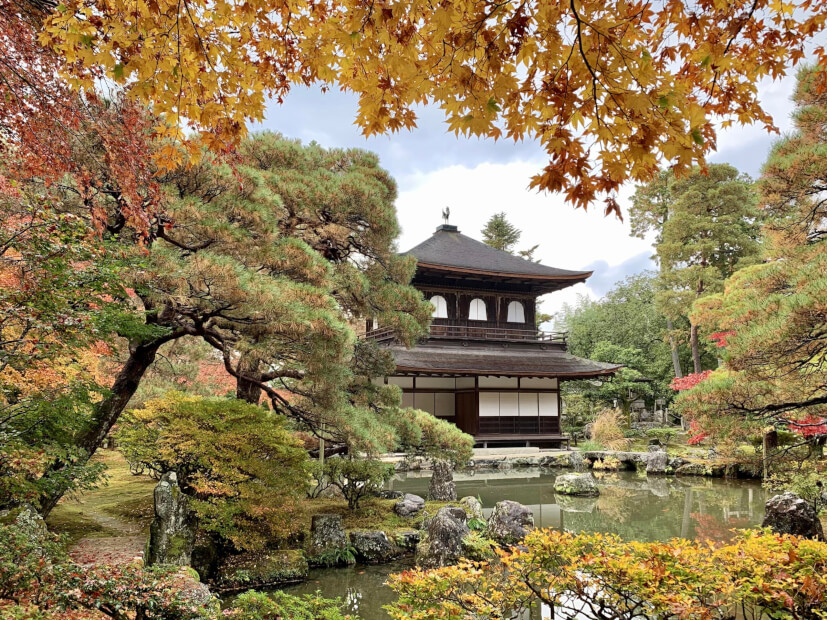
Locate an element on the screen. This screenshot has height=620, width=827. white rounded windows is located at coordinates (375, 319), (438, 309), (479, 311), (519, 315).